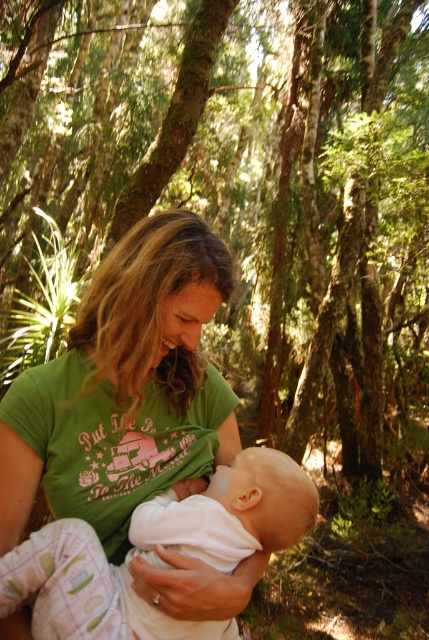
Does green cotton shirt at center appear over white soft baby at center?

Correct, green cotton shirt at center is located above white soft baby at center.

Is point (135, 259) positioned behind point (57, 614)?

Yes, it is behind point (57, 614).

You are a GUI agent. You are given a task and a screenshot of the screen. Output one action in this format:
    pyautogui.click(x=<x>, y=<y>)
    Task: Click on the green cotton shirt at center
    This screenshot has width=429, height=640.
    Given the screenshot: What is the action you would take?
    pyautogui.click(x=123, y=388)

At what (x,y) coordinates should I click in order to perform the action: click on green cotton shirt at center. Please return your answer as a coordinate pair (x, y). This screenshot has width=429, height=640. Looking at the image, I should click on (123, 388).